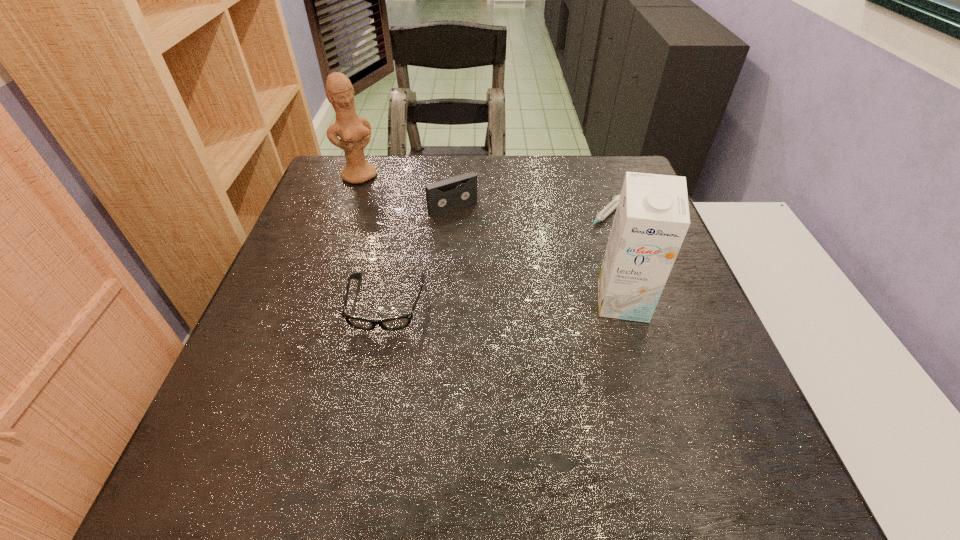
I want to click on vacant space on the desktop that is between the spectacles and the carton and is positioned at the needle end of the shortest object, so [x=515, y=302].

The height and width of the screenshot is (540, 960). Identify the location of vacant space on the desktop that is between the spectacles and the carton and is positioned on the front-facing side of the videotape. (532, 302).

In order to click on vacant space on the desktop that is between the second shortest object and the carton and is positioned on the front-facing side of the farthest object in this screenshot , I will do click(x=473, y=303).